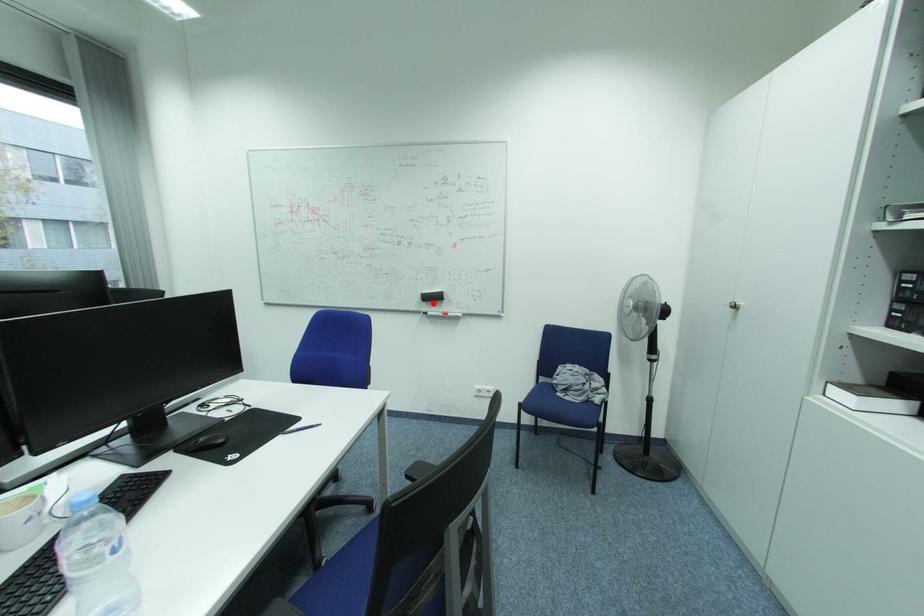
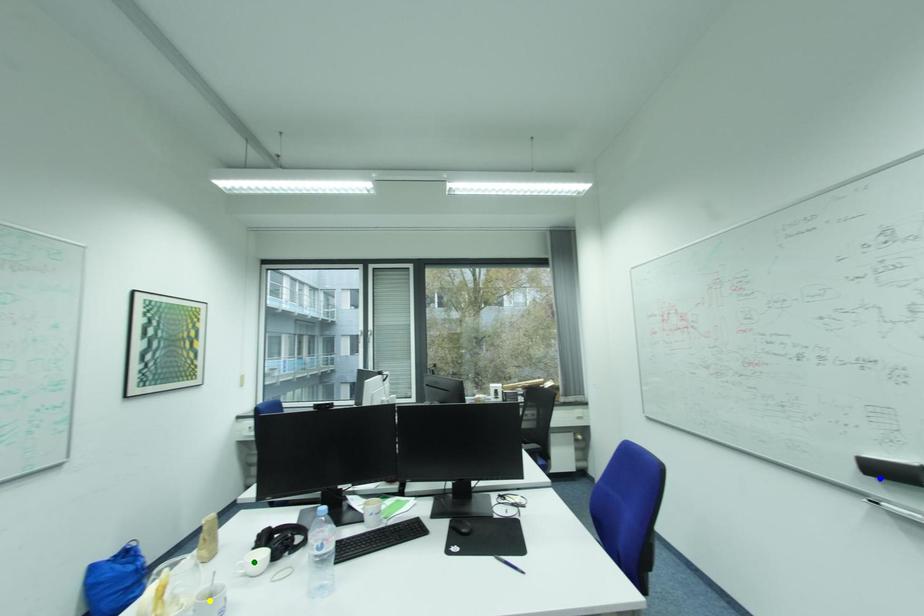
Question: I am providing you with two images of the same scene from different viewpoints. A red point is marked on the first image. You are given multiple points on the second image. Can you choose the point in image 2 that corresponds to the point in image 1?

Choices:
 (A) green point
 (B) blue point
 (C) yellow point

Answer: (B)